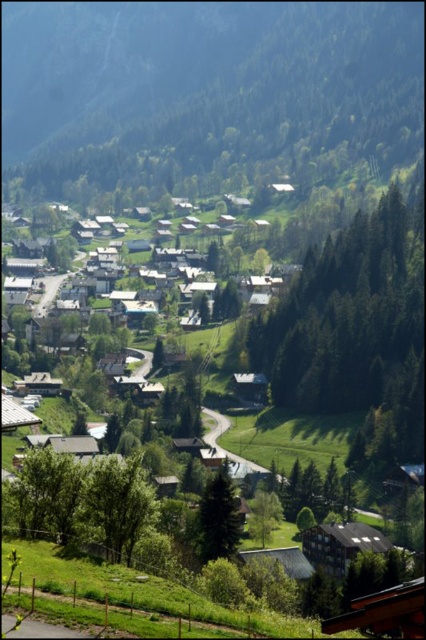
You are standing in the mountain village and want to take a photo of both the green leafy tree at center and the green leafy tree at lower left. Which tree should you frame closer to the front of the photo to include both in the shot?

You should frame the green leafy tree at lower left closer to the front of the photo because it is smaller than the green leafy tree at center, allowing both to fit within the frame.

You are standing in the mountain village and want to take a photo of both the green leafy tree at lower left and the green matte tree at center. Which tree should you position yourself to the left of to include both in your camera frame?

You should position yourself to the left of the green leafy tree at lower left to include both the green leafy tree at lower left and the green matte tree at center in your camera frame since the green leafy tree at lower left is to the left of the green matte tree at center.

You are a hiker planning to walk from the green leafy tree at center to the green textured mountain at center. Given that your average walking pace is 1.5 meters per second, how many minutes will it take you to reach the mountain?

The distance between the green textured mountain at center and the green leafy tree at center is 270.97 meters. At a pace of 1.5 meters per second, it would take approximately 180.65 seconds, which converts to about 3.01 minutes. Therefore, it will take roughly 3 minutes to reach the mountain.